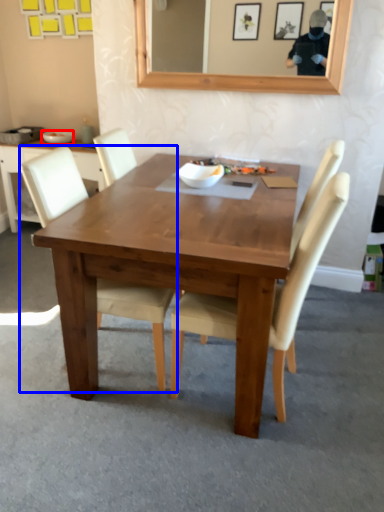
Question: Which object appears closest to the camera in this image, bowl (highlighted by a red box) or chair (highlighted by a blue box)?

Choices:
 (A) bowl
 (B) chair

Answer: (B)